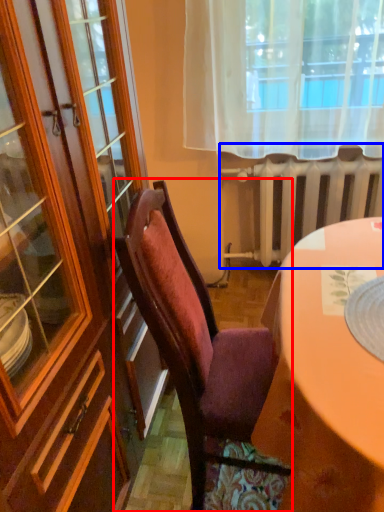
Question: Which object is further to the camera taking this photo, chair (highlighted by a red box) or radiator (highlighted by a blue box)?

Choices:
 (A) chair
 (B) radiator

Answer: (B)